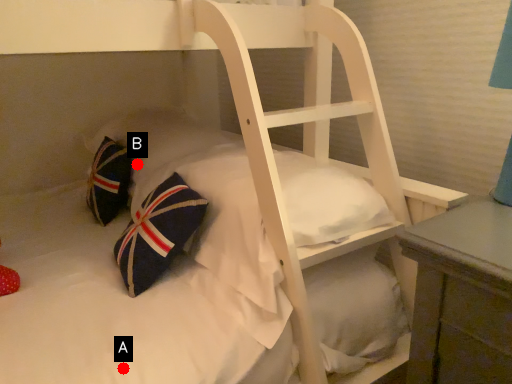
Question: Two points are circled on the image, labeled by A and B beside each circle. Which point is closer to the camera?

Choices:
 (A) A is closer
 (B) B is closer

Answer: (A)